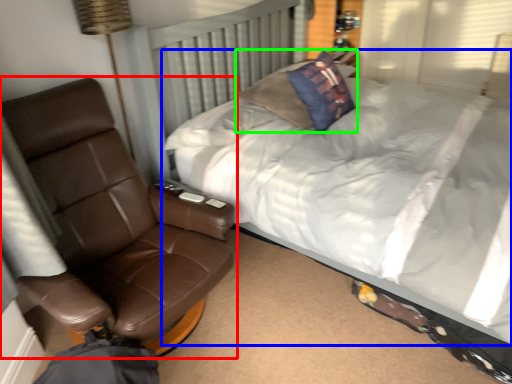
Question: Based on their relative distances, which object is farther from chair (highlighted by a red box)? Choose from bed (highlighted by a blue box) and pillow (highlighted by a green box).

Choices:
 (A) bed
 (B) pillow

Answer: (B)